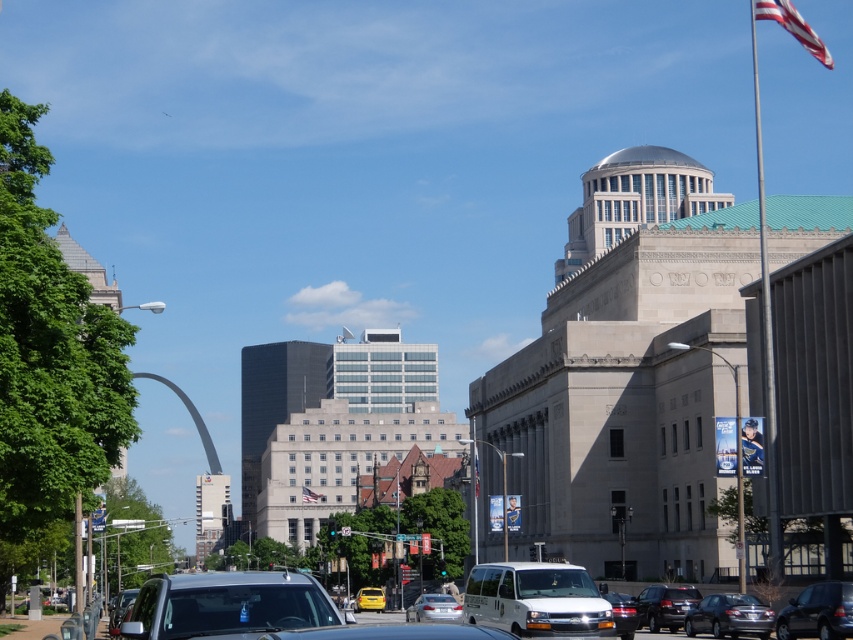
Question: In this image, where is yellow matte taxi at center located relative to american flag at center?

Choices:
 (A) left
 (B) right

Answer: (B)

Question: Which object is the farthest from the white matte van at center?

Choices:
 (A) yellow matte taxi at center
 (B) shiny black sedan at lower right
 (C) shiny black sedan at center

Answer: (A)

Question: Estimate the real-world distances between objects in this image. Which object is farther from the yellow matte taxi at center?

Choices:
 (A) shiny black sedan at center
 (B) american flag at center

Answer: (B)

Question: Does metallic flagpole at right appear on the left side of american flag at center?

Choices:
 (A) yes
 (B) no

Answer: (B)

Question: Estimate the real-world distances between objects in this image. Which object is closer to the white matte van at center?

Choices:
 (A) shiny black sedan at center
 (B) metallic flagpole at right
 (C) american flag at center
 (D) silver metallic car at lower left

Answer: (A)

Question: Does silver metallic car at lower left have a lesser width compared to yellow matte taxi at center?

Choices:
 (A) no
 (B) yes

Answer: (A)